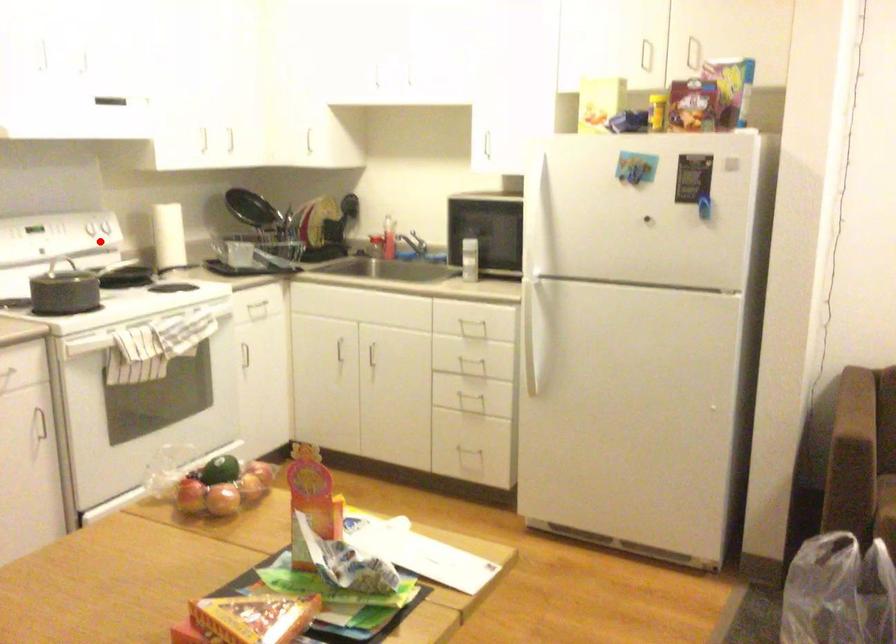
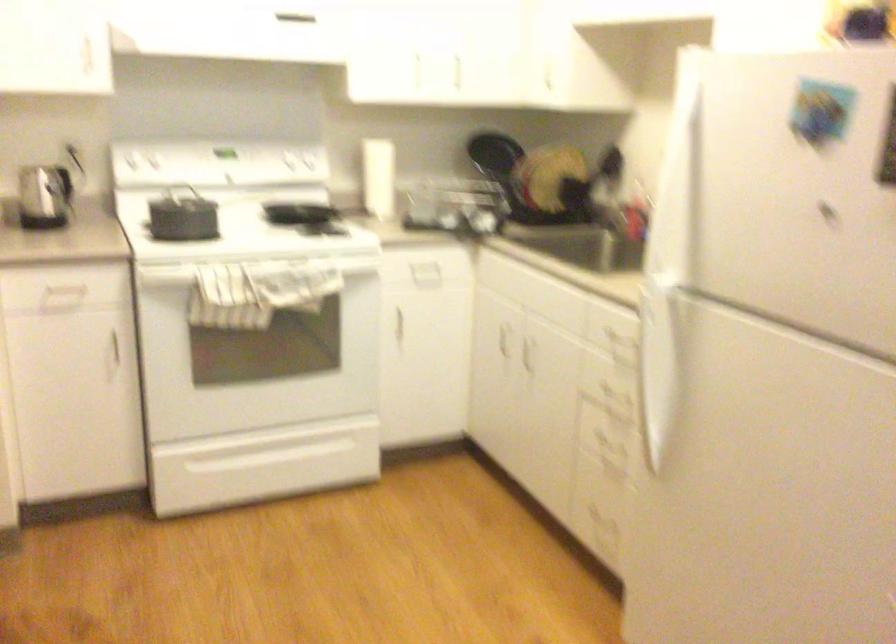
Find the pixel in the second image that matches the highlighted location in the first image.

(283, 169)